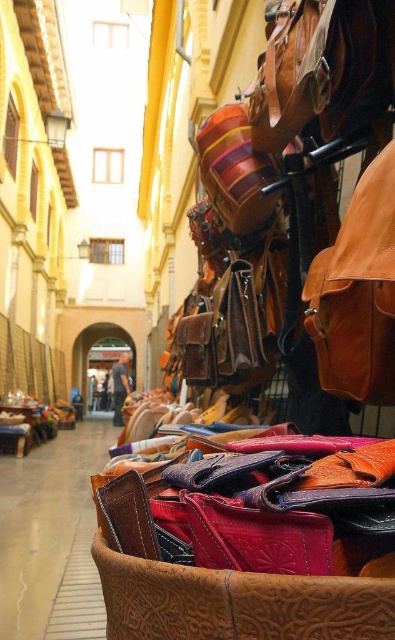
Can you confirm if brown leather wallet at center is taller than matte brown leather store at center?

Incorrect, brown leather wallet at center's height is not larger of matte brown leather store at center's.

Does brown leather wallet at center have a greater width compared to matte brown leather store at center?

Yes, brown leather wallet at center is wider than matte brown leather store at center.

The height and width of the screenshot is (640, 395). Describe the element at coordinates (52, 538) in the screenshot. I see `brown leather wallet at center` at that location.

The width and height of the screenshot is (395, 640). Identify the location of brown leather wallet at center. (52, 538).